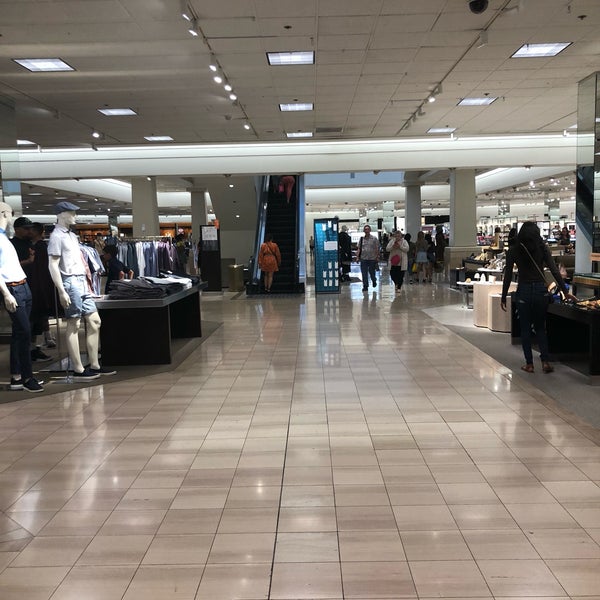
Where is `mannequins`? The height and width of the screenshot is (600, 600). mannequins is located at coordinates (58, 228), (3, 227).